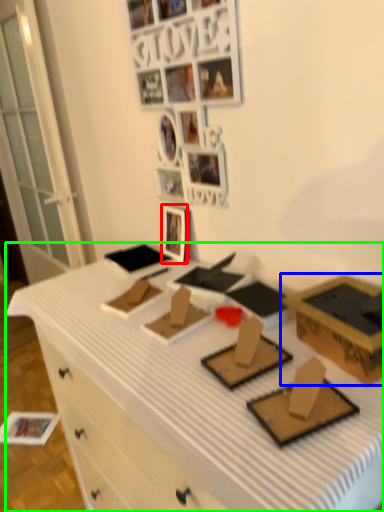
Question: Based on their relative distances, which object is farther from picture frame (highlighted by a red box)? Choose from box (highlighted by a blue box) and desk (highlighted by a green box).

Choices:
 (A) box
 (B) desk

Answer: (A)